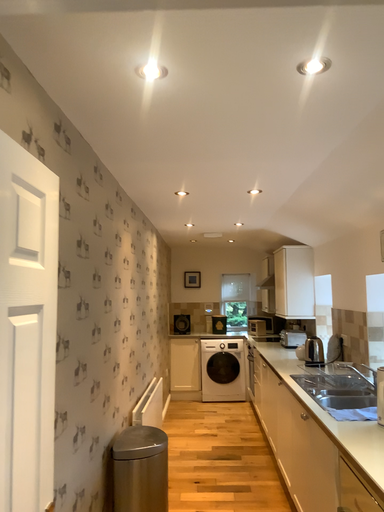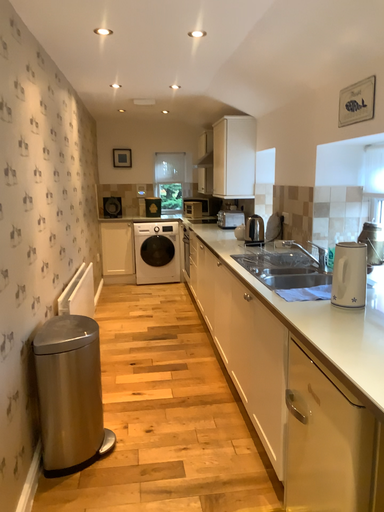
Question: Which way did the camera rotate in the video?

Choices:
 (A) rotated upward
 (B) rotated downward

Answer: (B)